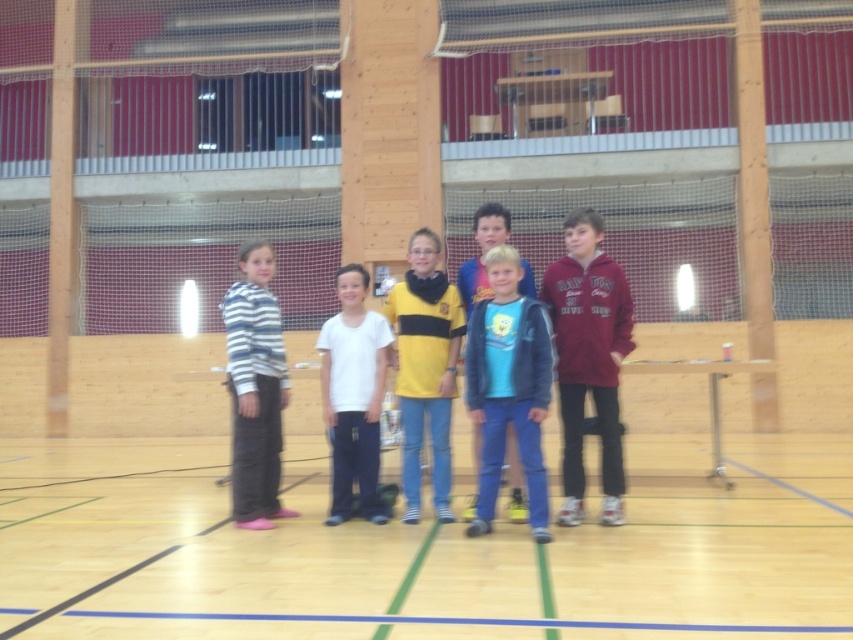
Can you confirm if maroon fleece jacket at center is bigger than white matte t-shirt at center?

Indeed, maroon fleece jacket at center has a larger size compared to white matte t-shirt at center.

Based on the photo, who is more distant from viewer, (595, 340) or (350, 292)?

Point (350, 292)

Is point (569, 522) farther from camera compared to point (334, 508)?

No, it is not.

Locate an element on the screen. The height and width of the screenshot is (640, 853). maroon fleece jacket at center is located at coordinates (x=589, y=356).

Who is more distant from viewer, (538, 314) or (252, 252)?

Positioned behind is point (252, 252).

Is point (527, 458) closer to camera compared to point (271, 410)?

Yes, it is.

Identify the location of blue matte shirt at center. (508, 387).

Between point (254, 412) and point (345, 365), which one is positioned in front?

Point (254, 412) is more forward.

At what (x,y) coordinates should I click in order to perform the action: click on striped hoodie at left. Please return your answer as a coordinate pair (x, y). Looking at the image, I should click on (254, 388).

The height and width of the screenshot is (640, 853). I want to click on striped hoodie at left, so click(x=254, y=388).